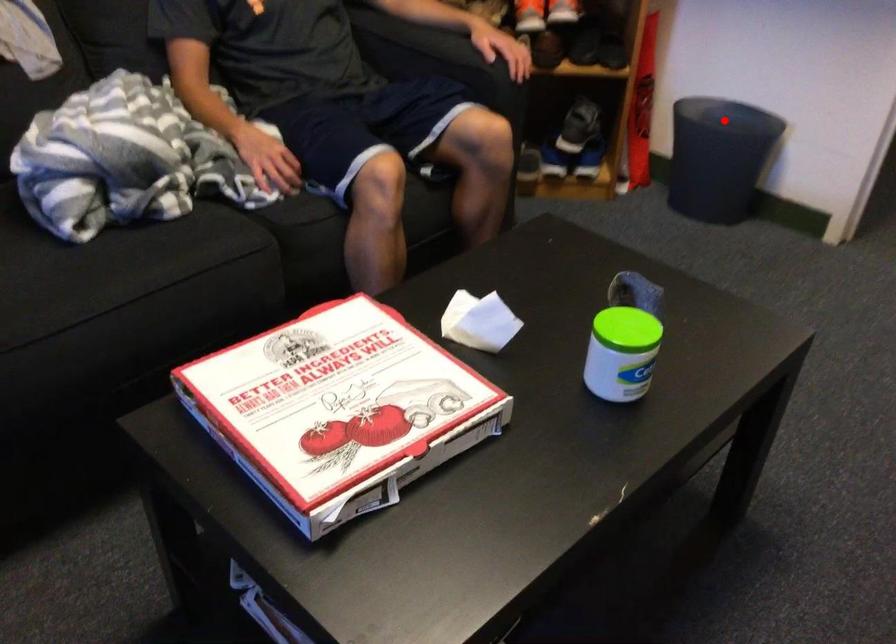
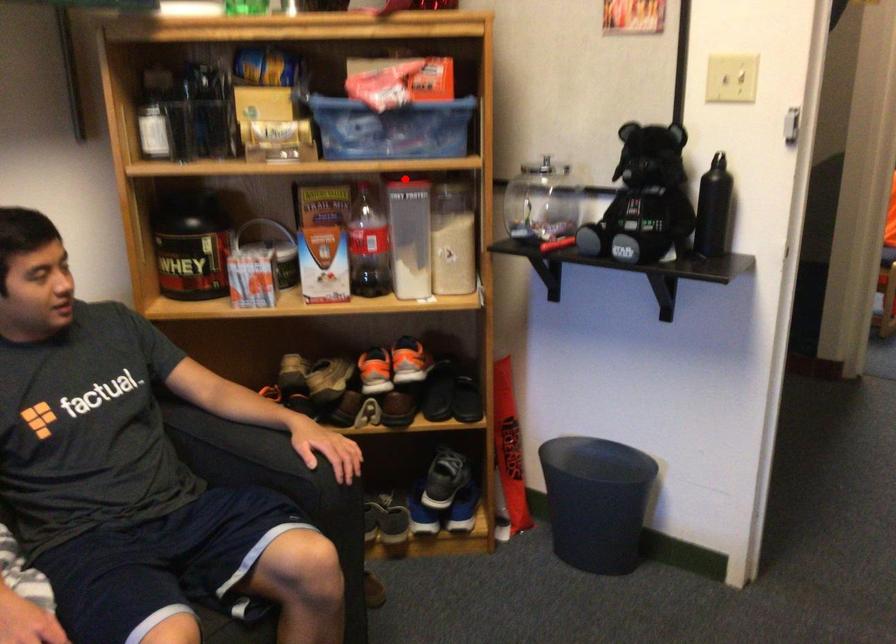
I am providing you with two images of the same scene from different viewpoints. A red point is marked on the first image and another point is marked on the second image. Are the points marked in image1 and image2 representing the same 3D position?

No